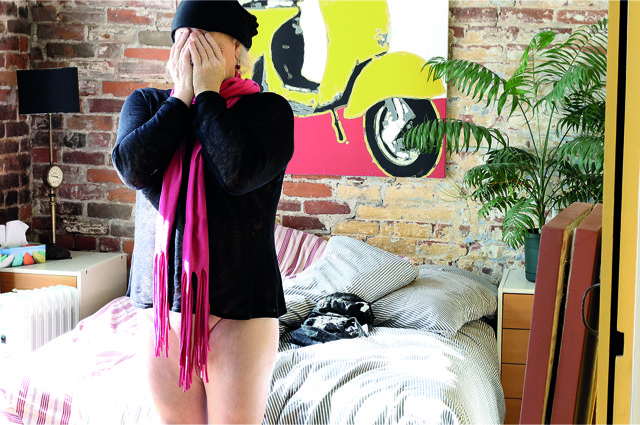
I want to click on brick wall, so click(x=88, y=50), click(x=8, y=59).